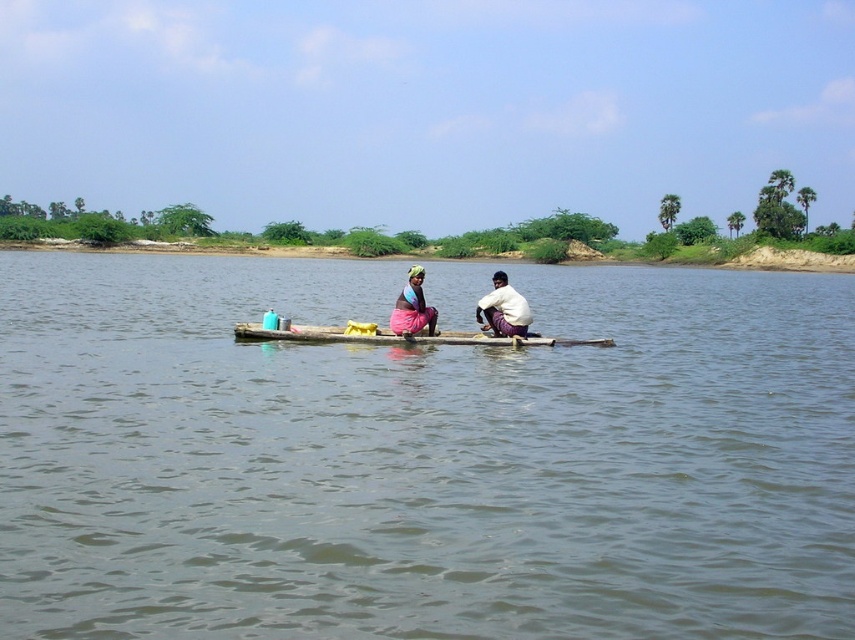
Consider the image. You are standing on the riverside and see the brown wooden raft at center and the wooden log boat at center. Which one is closer to you?

The brown wooden raft at center is closer to you because it is located above the wooden log boat at center, indicating it is nearer in the visual plane.

You are an observer standing on the riverside bank. You notice the wooden log boat at center and the matte pink fabric at center. Which object has a greater height?

The matte pink fabric at center is taller than the wooden log boat at center because the wooden log boat at center is not as tall as matte pink fabric at center.